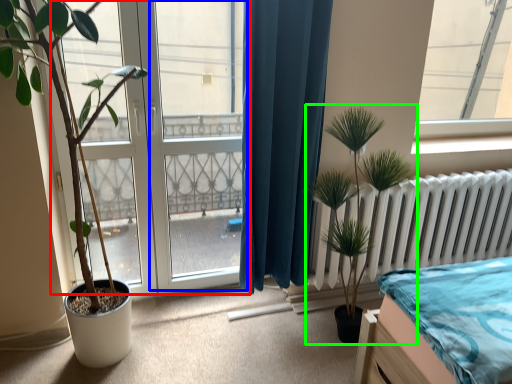
Question: Which object is positioned farthest from bay window (highlighted by a red box)? Select from screen door (highlighted by a blue box) and houseplant (highlighted by a green box).

Choices:
 (A) screen door
 (B) houseplant

Answer: (B)